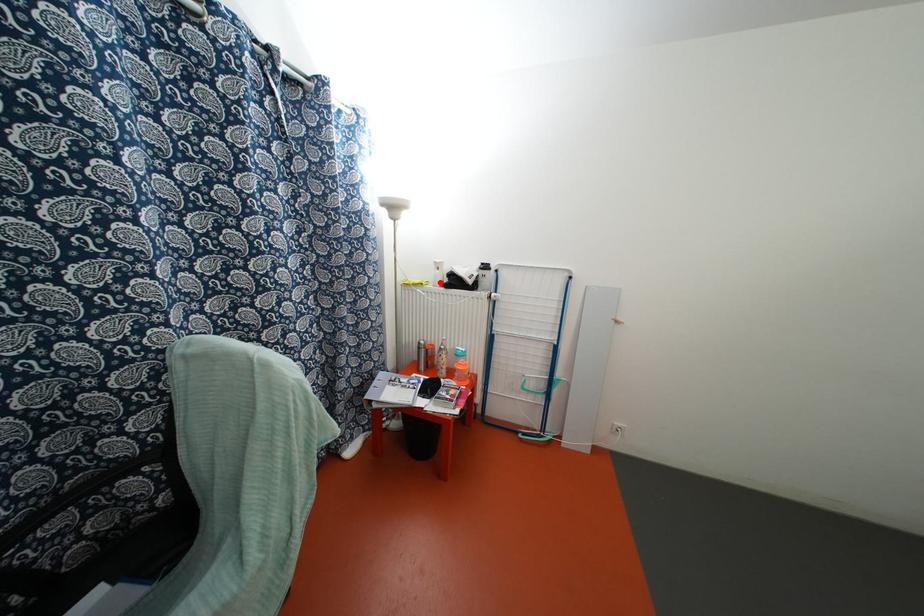
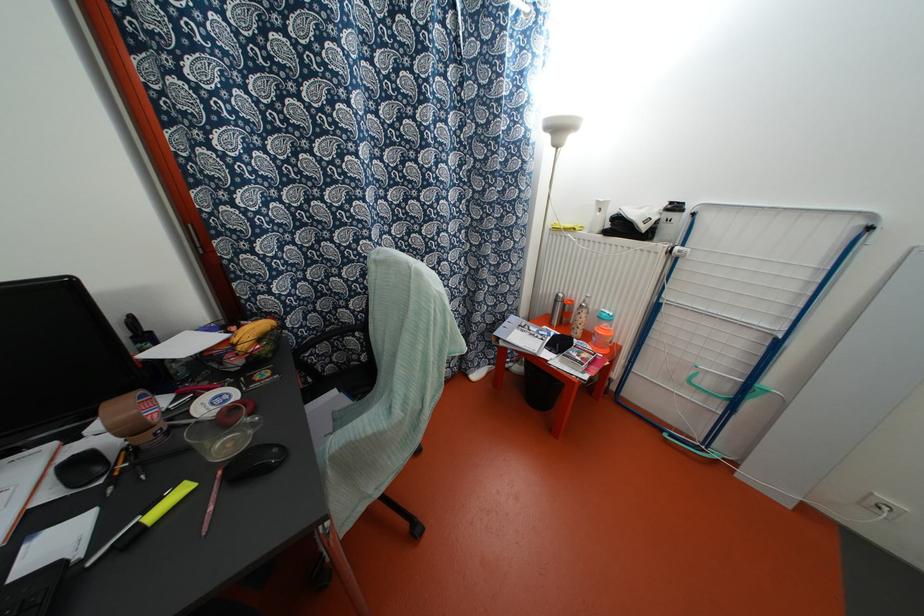
Question: I am providing you with two images of the same scene from different viewpoints. A red point is marked on the first image. At the location where the point appears in image 1, is it still visible in image 2?

Choices:
 (A) Yes
 (B) No

Answer: (A)